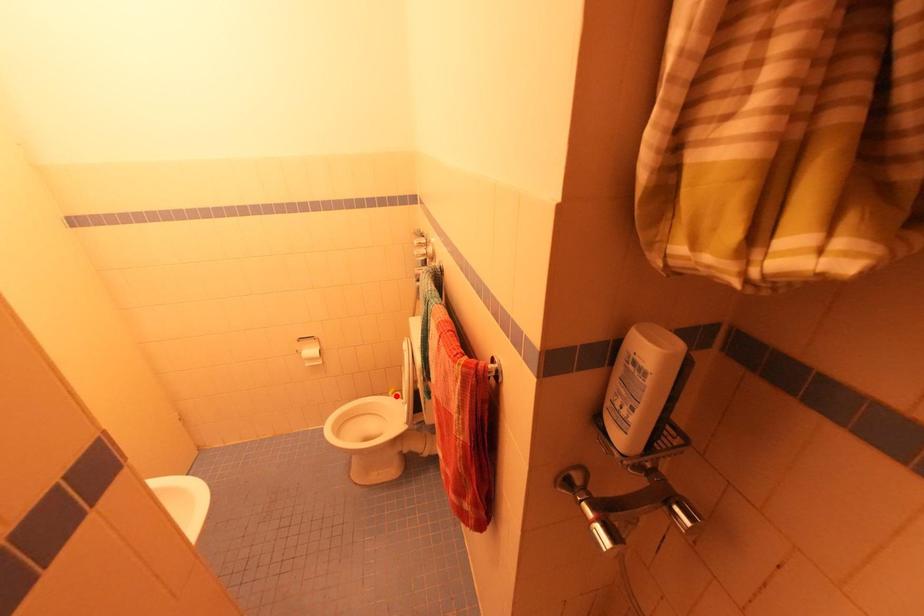
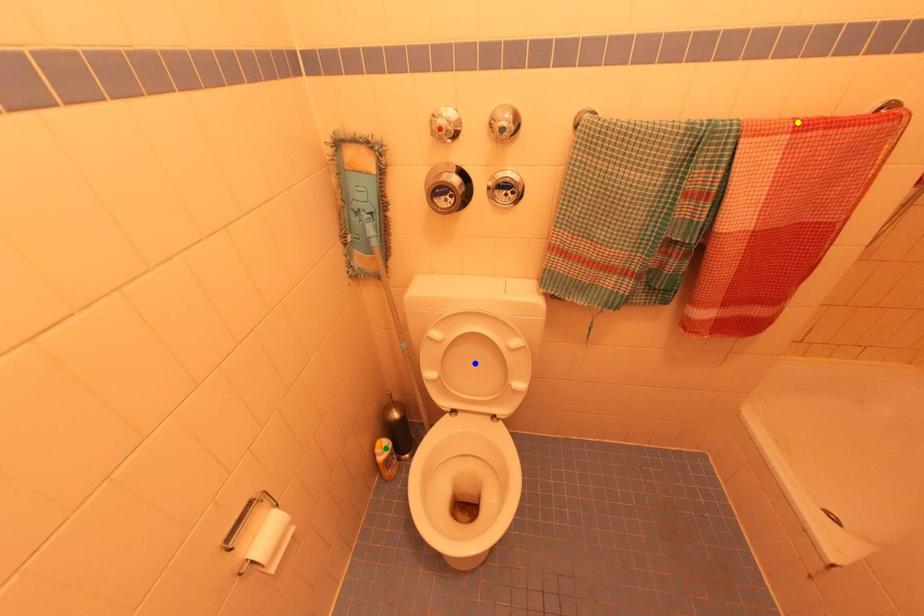
Question: I am providing you with two images of the same scene from different viewpoints. A red point is marked on the first image. You are given multiple points on the second image. Which spot in image 2 lines up with the point in image 1?

Choices:
 (A) blue point
 (B) yellow point
 (C) green point

Answer: (C)